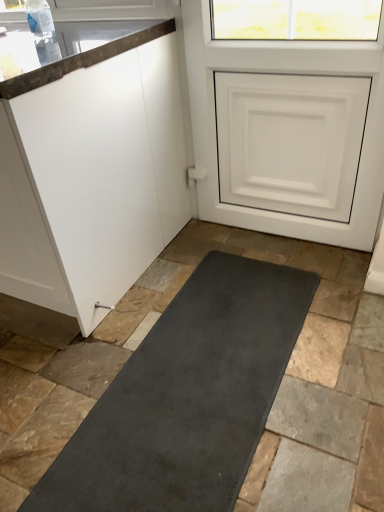
Where is `white matte cabinet at left`? white matte cabinet at left is located at coordinates (93, 177).

This screenshot has width=384, height=512. What do you see at coordinates (93, 177) in the screenshot?
I see `white matte cabinet at left` at bounding box center [93, 177].

Identify the location of white matte door at upper right. The width and height of the screenshot is (384, 512). (283, 71).

Image resolution: width=384 pixels, height=512 pixels. What do you see at coordinates (283, 71) in the screenshot?
I see `white matte door at upper right` at bounding box center [283, 71].

This screenshot has width=384, height=512. Identify the location of white matte cabinet at left. (93, 177).

Can you confirm if white matte cabinet at left is positioned to the left of white matte door at upper right?

Yes.

Considering their positions, is white matte cabinet at left located in front of or behind white matte door at upper right?

In the image, white matte cabinet at left appears in front of white matte door at upper right.

Does point (151, 232) come behind point (198, 126)?

No, it is not.

From the image's perspective, between white matte cabinet at left and white matte door at upper right, who is located below?

white matte cabinet at left appears lower in the image.

From a real-world perspective, is white matte cabinet at left physically located above or below white matte door at upper right?

white matte cabinet at left is situated lower than white matte door at upper right in the real world.

Between white matte cabinet at left and white matte door at upper right, which one has smaller width?

With smaller width is white matte door at upper right.

Considering the sizes of objects white matte cabinet at left and white matte door at upper right in the image provided, who is shorter, white matte cabinet at left or white matte door at upper right?

white matte cabinet at left.

Who is smaller, white matte cabinet at left or white matte door at upper right?

white matte door at upper right is smaller.

Do you think white matte cabinet at left is within white matte door at upper right, or outside of it?

The correct answer is: outside.

Is white matte cabinet at left far from white matte door at upper right?

No, white matte cabinet at left is not far from white matte door at upper right.

Is white matte cabinet at left facing away from white matte door at upper right?

That's not correct — white matte cabinet at left is not looking away from white matte door at upper right.

How many degrees apart are the facing directions of white matte cabinet at left and white matte door at upper right?

They differ by 0.521 degrees in their facing directions.

How far apart are white matte cabinet at left and white matte door at upper right?

A distance of 21.86 inches exists between white matte cabinet at left and white matte door at upper right.

The image size is (384, 512). What are the coordinates of `cabinetry in front of the white matte door at upper right` in the screenshot? It's located at 93,177.

Consider the image. Considering the relative positions of white matte door at upper right and white matte cabinet at left in the image provided, is white matte door at upper right to the right of white matte cabinet at left from the viewer's perspective?

Yes, white matte door at upper right is to the right of white matte cabinet at left.

Relative to white matte cabinet at left, is white matte door at upper right in front or behind?

white matte door at upper right is behind white matte cabinet at left.

Does point (287, 57) come farther from viewer compared to point (161, 159)?

That is False.

From the image's perspective, is white matte door at upper right beneath white matte cabinet at left?

No.

From a real-world perspective, who is located lower, white matte door at upper right or white matte cabinet at left?

white matte cabinet at left is physically lower.

Between white matte door at upper right and white matte cabinet at left, which one has smaller width?

Answer: With smaller width is white matte door at upper right.

Is white matte door at upper right taller or shorter than white matte cabinet at left?

white matte door at upper right is taller than white matte cabinet at left.

Is white matte door at upper right smaller than white matte cabinet at left?

Indeed, white matte door at upper right has a smaller size compared to white matte cabinet at left.

Is white matte door at upper right not within white matte cabinet at left?

Yes, white matte door at upper right is located beyond the bounds of white matte cabinet at left.

Is white matte door at upper right not close to white matte cabinet at left?

That's not correct — white matte door at upper right is a little close to white matte cabinet at left.

Is white matte door at upper right aimed at white matte cabinet at left?

No, white matte door at upper right is not turned towards white matte cabinet at left.

How different are the orientations of white matte door at upper right and white matte cabinet at left in degrees?

white matte door at upper right and white matte cabinet at left are facing 0.521 degrees away from each other.

In the image, there is a white matte cabinet at left. What are the coordinates of `door above it (from the image's perspective)` in the screenshot? It's located at (283, 71).

At what (x,y) coordinates should I click in order to perform the action: click on door lying on the right of white matte cabinet at left. Please return your answer as a coordinate pair (x, y). Looking at the image, I should click on (283, 71).

Where is `door above the white matte cabinet at left (from the image's perspective)`? door above the white matte cabinet at left (from the image's perspective) is located at coordinates (283, 71).